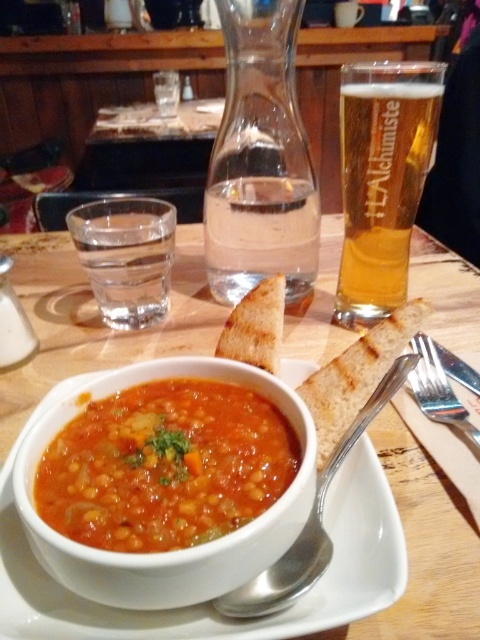
Is point (312, 531) positioned before point (437, 412)?

That is True.

Is silver spoon at center to the left of satin silver fork at lower right from the viewer's perspective?

Correct, you'll find silver spoon at center to the left of satin silver fork at lower right.

Does point (387, 388) come closer to viewer compared to point (420, 364)?

Yes, it is in front of point (420, 364).

The image size is (480, 640). In order to click on silver spoon at center in this screenshot , I will do `click(311, 522)`.

Does point (187, 259) come farther from viewer compared to point (264, 600)?

Yes, point (187, 259) is behind point (264, 600).

Can you confirm if white ceramic bowl at center is bigger than silver spoon at center?

Correct, white ceramic bowl at center is larger in size than silver spoon at center.

Is point (421, 504) farther from camera compared to point (305, 576)?

That is True.

The image size is (480, 640). In order to click on white ceramic bowl at center in this screenshot , I will do click(95, 320).

Is white ceramic bowl at center to the left of golden brown toasted bread at center from the viewer's perspective?

Yes, white ceramic bowl at center is to the left of golden brown toasted bread at center.

Between white ceramic bowl at center and golden brown toasted bread at center, which one is positioned higher?

Positioned higher is white ceramic bowl at center.

The height and width of the screenshot is (640, 480). Find the location of `white ceramic bowl at center`. white ceramic bowl at center is located at coordinates pyautogui.click(x=95, y=320).